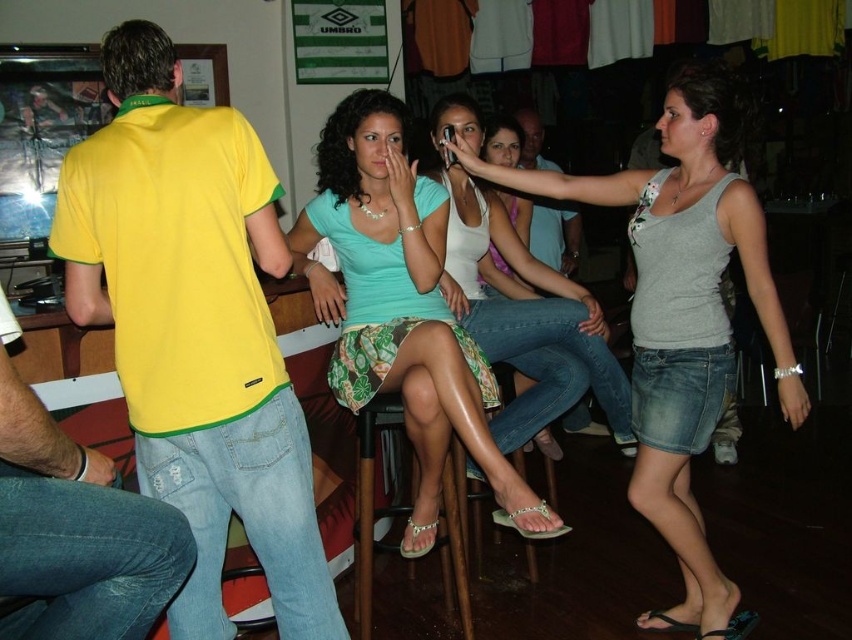
You are standing at the entrance of the bar and want to greet both the person in the yellow cotton shirt at left and the person in the light green fabric skirt at center. Which one should you approach first based on their positions?

The yellow cotton shirt at left is below the light green fabric skirt at center, so you should approach the light green fabric skirt at center first as they are closer to the entrance.

Consider the image. Based on the scene description, can you determine if the jeans at left are positioned higher than the wooden bar stool at lower center?

Yes, the jeans at left are positioned above the wooden bar stool at lower center according to the description.

You are a photographer standing in the scene and want to capture both the light green fabric skirt at center and the jeans at left in the same photo. Since the skirt is above the jeans, where should you position your camera to ensure both are visible?

To capture both the light green fabric skirt at center and the jeans at left in the same photo, position your camera so it can see upwards towards the light green fabric skirt at center and downwards towards the jeans at left, since the skirt is above the jeans.